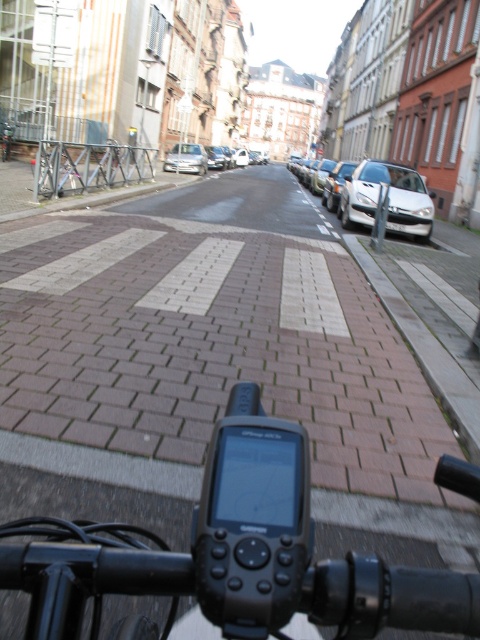
You are riding a bicycle and looking at the handlebars. You see a black plastic GPS device at center and a silver metallic car at center. Which object is closer to you?

The black plastic GPS device at center is closer to you because it is positioned below the silver metallic car at center, meaning it is in a lower, nearer position from your viewpoint.

You are riding a bicycle and looking forward. There are two points marked on the road ahead. The first point is at position point (407,182) and the second is at point (72,166). Which point will you reach first while moving forward?

Point (72,166) will be reached first because it is in front of point (407,182), which is positioned behind it according to the spatial relationship described.

You are riding a metallic silver bicycle at left and want to pass a silver metallic car at center parked on the right side of the street. Given that the road is narrow, can your bicycle fit through the space between the parked cars and the curb?

The metallic silver bicycle at left is wider than the silver metallic car at center, so it may not fit through the narrow space between the parked cars and the curb.